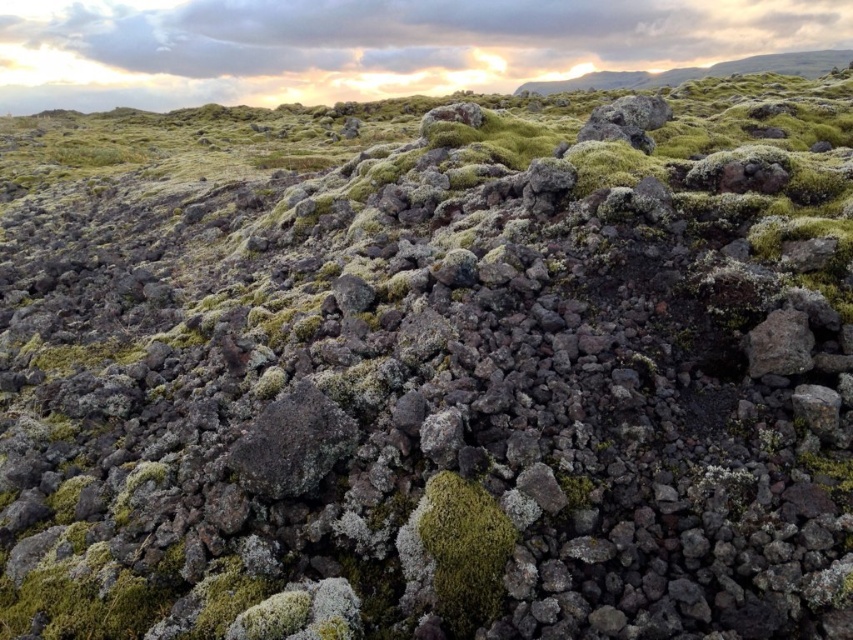
You are a geologist hiking in this volcanic terrain and need to collect samples from both the dark gray rock at center and the gray rough rock at right. If your sample bag can only hold items within a 10 foot radius, will you be able to collect both rocks without moving your bag?

The dark gray rock at center is 12.49 feet away from the gray rough rock at right, which exceeds the 10 foot radius limit. Therefore, you cannot collect both rocks without moving your sample bag.